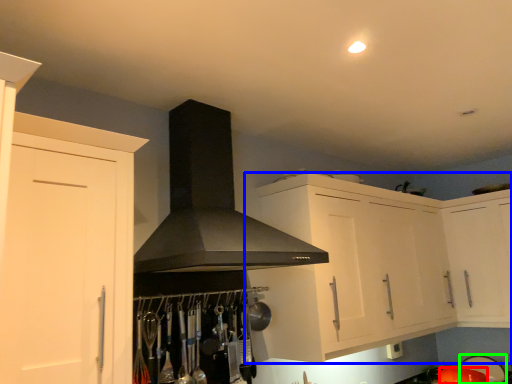
Question: Which is farther away from appliance (highlighted by a red box)? cabinetry (highlighted by a blue box) or appliance (highlighted by a green box)?

Choices:
 (A) cabinetry
 (B) appliance

Answer: (A)